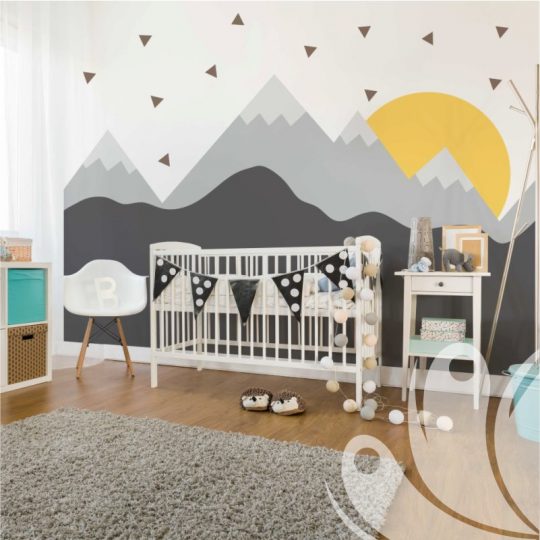
Where is `chair legs`? This screenshot has width=540, height=540. chair legs is located at coordinates 123,339, 83,343.